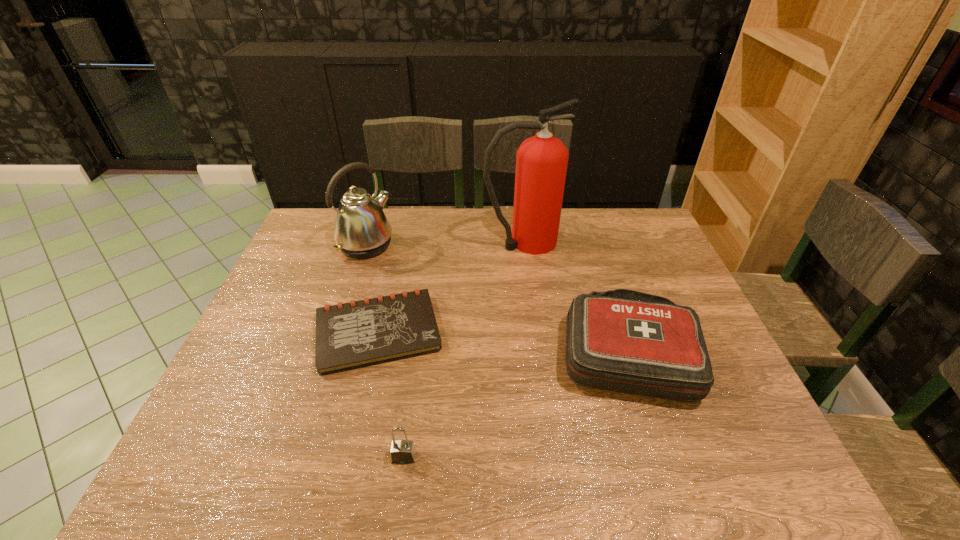
Locate an element on the screen. This screenshot has height=540, width=960. kettle located at the far edge is located at coordinates (362, 230).

The image size is (960, 540). Identify the location of object that is at the near edge. (402, 452).

Where is `object at the left edge`? object at the left edge is located at coordinates (362, 230).

At what (x,y) coordinates should I click in order to perform the action: click on object positioned at the right edge. Please return your answer as a coordinate pair (x, y). Looking at the image, I should click on (621, 340).

This screenshot has width=960, height=540. In order to click on object positioned at the far left corner in this screenshot , I will do tap(362, 230).

This screenshot has height=540, width=960. Identify the location of free space at the far edge. (610, 240).

Where is `free space at the near edge`? This screenshot has height=540, width=960. free space at the near edge is located at coordinates (484, 443).

This screenshot has height=540, width=960. What are the coordinates of `free space at the left edge of the desktop` in the screenshot? It's located at (307, 301).

This screenshot has width=960, height=540. In order to click on free space at the right edge of the desktop in this screenshot , I will do `click(698, 307)`.

I want to click on blank area at the far left corner, so click(x=320, y=231).